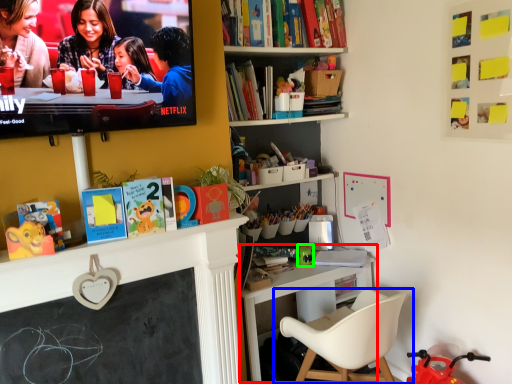
Question: Based on their relative distances, which object is nearer to table (highlighted by a red box)? Choose from chair (highlighted by a blue box) and toy (highlighted by a green box).

Choices:
 (A) chair
 (B) toy

Answer: (B)